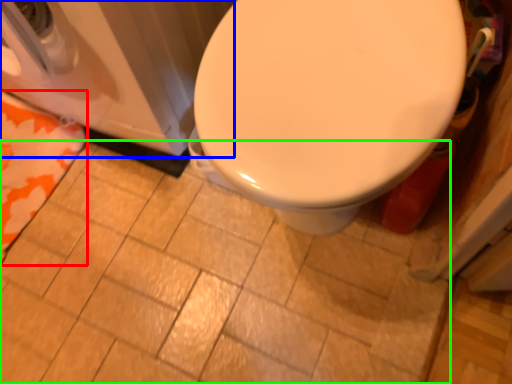
Question: Considering the real-world distances, which object is closest to beach towel (highlighted by a red box)? washer (highlighted by a blue box) or ceramic tile (highlighted by a green box).

Choices:
 (A) washer
 (B) ceramic tile

Answer: (A)